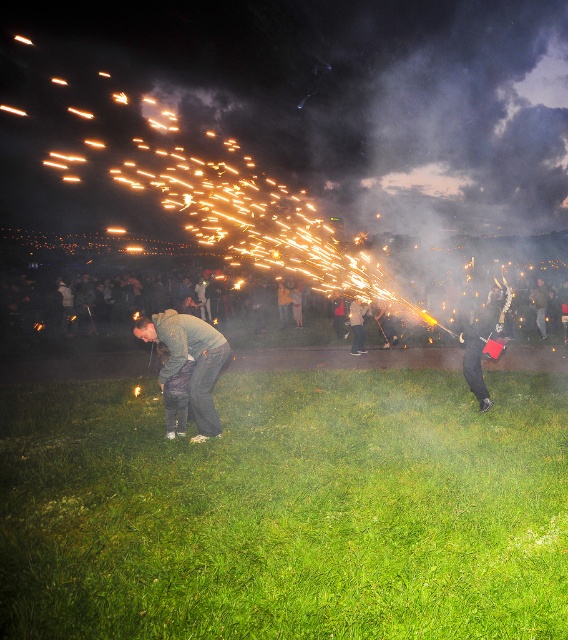
You are standing at the point marked as point (287,509) in the image. What is the surface you are standing on?

The point (287,509) is on green grass at lower center, so you are standing on green grass.

Consider the image. You are a photographer trying to capture the best shot of the dark gray hoodie at center and the dark gray pants at center. Which one should you focus on first to ensure both are in sharp focus?

The dark gray hoodie at center is closer to the viewer than the dark gray pants at center, so focus on the dark gray hoodie at center first. This will ensure the pants remain in focus due to the depth of field extending beyond the closer subject.

You are at a nighttime event and see two people at the center dressed in dark gray. One is wearing dark gray pants at center and the other has a dark gray fabric jacket at center. Which clothing item is shorter?

The dark gray pants at center is shorter than the dark gray fabric jacket at center.